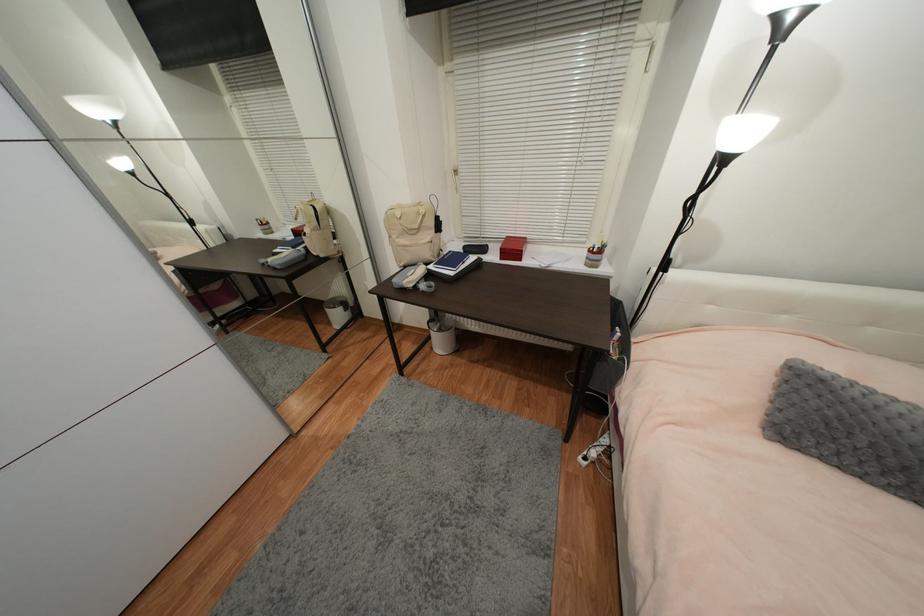
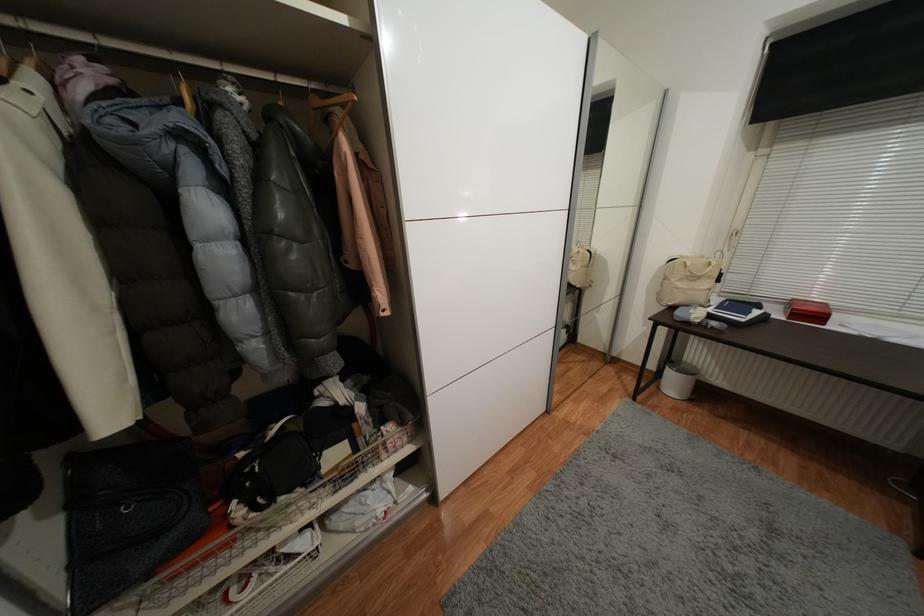
The point at (436, 350) is marked in the first image. Where is the corresponding point in the second image?

(663, 390)